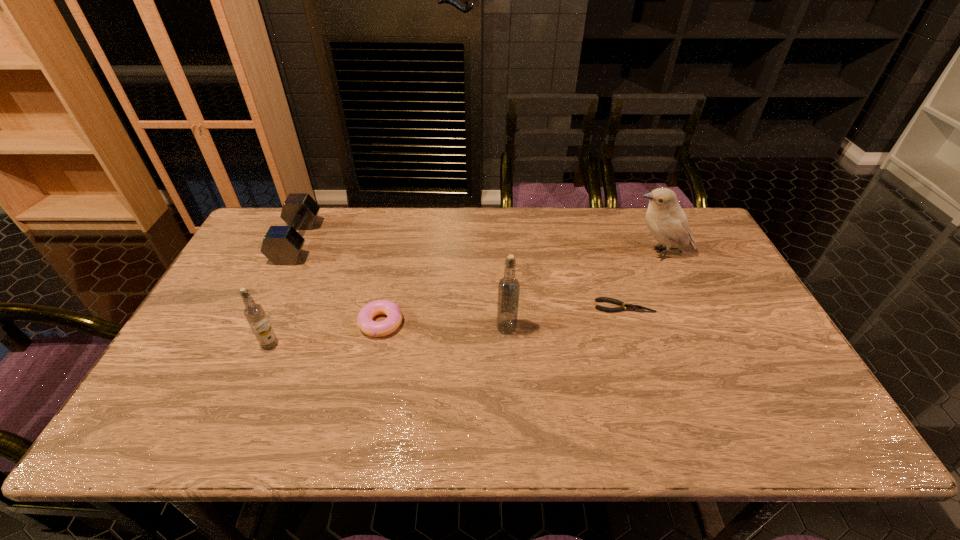
I want to click on vacant point that satisfies the following two spatial constraints: 1. on the back side of the fifth tallest object; 2. on the left side of the pliers, so click(384, 306).

Identify the location of blank area in the image that satisfies the following two spatial constraints: 1. on the front side of the shortest object; 2. on the label of the right vodka. Image resolution: width=960 pixels, height=540 pixels. (631, 327).

Find the location of `vacant space that satisfies the following two spatial constraints: 1. on the label of the third object from right to left; 2. on the label of the fourth shortest object`. vacant space that satisfies the following two spatial constraints: 1. on the label of the third object from right to left; 2. on the label of the fourth shortest object is located at coordinates (508, 345).